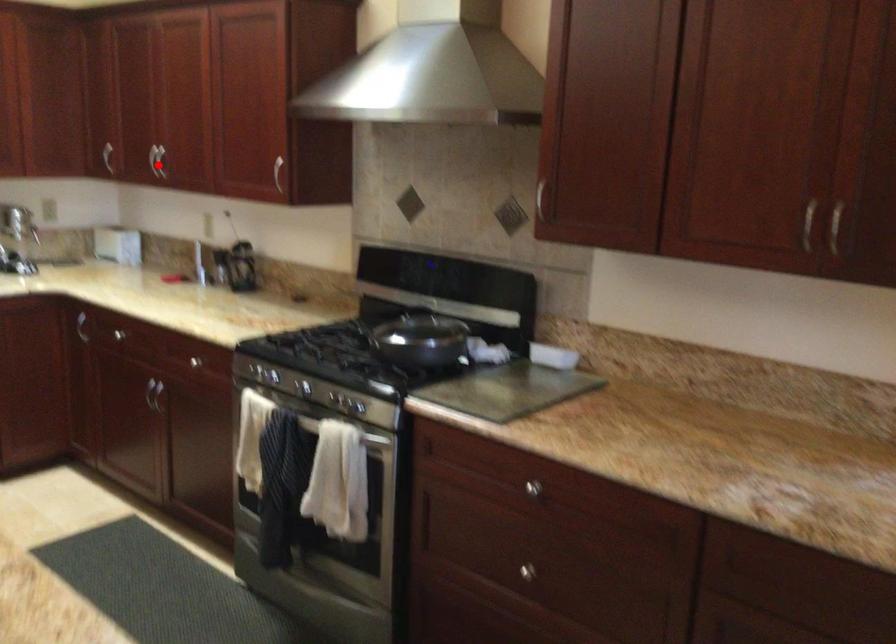
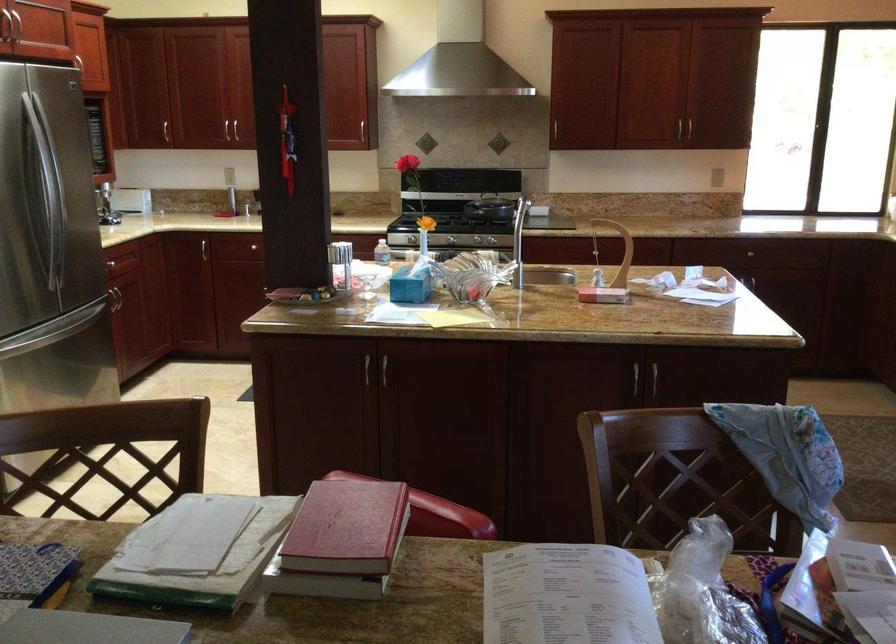
Where in the second image is the point corresponding to the highlighted location from the first image?

(165, 131)